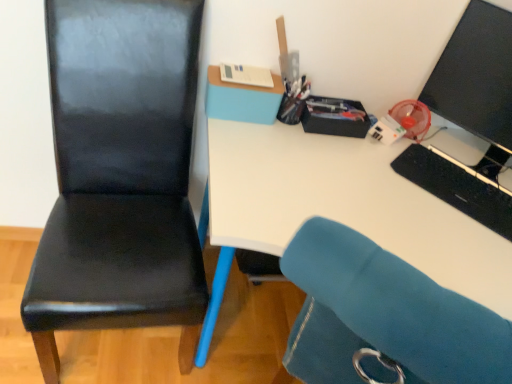
Question: Does black glossy monitor at upper right lie behind metallic pen holder at upper center, acting as the 2th stationery starting from the right?

Choices:
 (A) no
 (B) yes

Answer: (A)

Question: From the image's perspective, is black glossy monitor at upper right beneath metallic pen holder at upper center, which appears as the 2th stationery when viewed from the left?

Choices:
 (A) yes
 (B) no

Answer: (B)

Question: Could you tell me if black glossy monitor at upper right is facing metallic pen holder at upper center, acting as the 2th stationery starting from the right?

Choices:
 (A) yes
 (B) no

Answer: (B)

Question: Is black glossy monitor at upper right oriented away from metallic pen holder at upper center, which appears as the 2th stationery when viewed from the left?

Choices:
 (A) yes
 (B) no

Answer: (B)

Question: Is black glossy monitor at upper right wider than metallic pen holder at upper center, which appears as the 2th stationery when viewed from the left?

Choices:
 (A) yes
 (B) no

Answer: (A)

Question: In the image, is white paper at upper center, the 3th stationery from the right, positioned in front of or behind metallic pen holder at upper center, which appears as the 2th stationery when viewed from the left?

Choices:
 (A) behind
 (B) front

Answer: (B)

Question: From a real-world perspective, is white paper at upper center, the 1th stationery viewed from the left, physically located above or below metallic pen holder at upper center, acting as the 2th stationery starting from the right?

Choices:
 (A) below
 (B) above

Answer: (B)

Question: Is point pyautogui.click(x=231, y=77) closer or farther from the camera than point pyautogui.click(x=289, y=89)?

Choices:
 (A) closer
 (B) farther

Answer: (A)

Question: Is white paper at upper center, the 3th stationery from the right, inside or outside of metallic pen holder at upper center, acting as the 2th stationery starting from the right?

Choices:
 (A) outside
 (B) inside

Answer: (A)

Question: Is black leather chair at left wider or thinner than matte black stationery box at upper right, the third stationery from the left?

Choices:
 (A) thin
 (B) wide

Answer: (B)

Question: Is black leather chair at left to the left or to the right of matte black stationery box at upper right, which is the first stationery in right-to-left order, in the image?

Choices:
 (A) right
 (B) left

Answer: (B)

Question: Looking at the image, does black leather chair at left seem bigger or smaller compared to matte black stationery box at upper right, the third stationery from the left?

Choices:
 (A) small
 (B) big

Answer: (B)

Question: From a real-world perspective, is black leather chair at left positioned above or below matte black stationery box at upper right, the third stationery from the left?

Choices:
 (A) above
 (B) below

Answer: (B)

Question: From the image's perspective, is black glossy monitor at upper right located above or below matte black stationery box at upper right, which is the first stationery in right-to-left order?

Choices:
 (A) above
 (B) below

Answer: (A)

Question: From a real-world perspective, is black glossy monitor at upper right physically located above or below matte black stationery box at upper right, which is the first stationery in right-to-left order?

Choices:
 (A) above
 (B) below

Answer: (A)